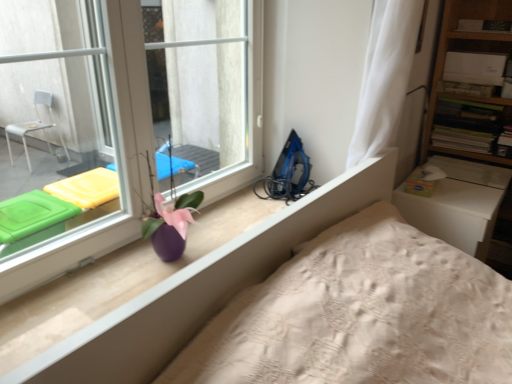
Question: Considering the positions of transparent glass window at upper left and wooden bookshelf at upper right in the image, is transparent glass window at upper left bigger or smaller than wooden bookshelf at upper right?

Choices:
 (A) small
 (B) big

Answer: (B)

Question: From a real-world perspective, is transparent glass window at upper left physically located above or below wooden bookshelf at upper right?

Choices:
 (A) below
 (B) above

Answer: (B)

Question: Based on their relative distances, which object is nearer to the wooden bookshelf at upper right?

Choices:
 (A) blue plastic iron at right
 (B) white sheer curtain at upper right
 (C) transparent glass window at upper left
 (D) purple glossy vase at center

Answer: (B)

Question: Estimate the real-world distances between objects in this image. Which object is closer to the purple glossy vase at center?

Choices:
 (A) white sheer curtain at upper right
 (B) wooden bookshelf at upper right
 (C) blue plastic iron at right
 (D) transparent glass window at upper left

Answer: (D)